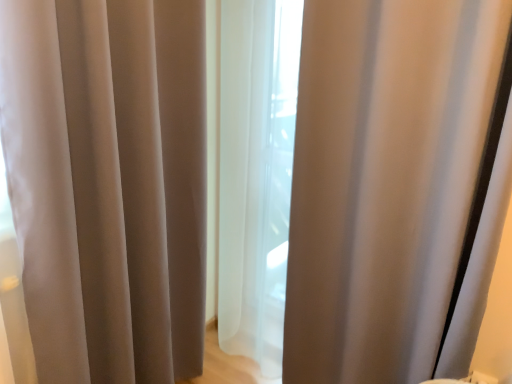
Question: In which direction should I rotate to look at satin beige curtain at center, which is counted as the first curtain, starting from the left?

Choices:
 (A) right
 (B) left

Answer: (B)

Question: Is satin-like beige curtain at center, positioned as the first curtain in right-to-left order, a part of satin beige curtain at center, which is counted as the first curtain, starting from the left?

Choices:
 (A) yes
 (B) no

Answer: (B)

Question: Can you confirm if satin beige curtain at center, which is counted as the first curtain, starting from the left, is thinner than satin-like beige curtain at center, positioned as the first curtain in right-to-left order?

Choices:
 (A) no
 (B) yes

Answer: (B)

Question: From a real-world perspective, is satin beige curtain at center, the 2th curtain positioned from the right, located higher than satin-like beige curtain at center, positioned as the first curtain in right-to-left order?

Choices:
 (A) no
 (B) yes

Answer: (A)

Question: From the image's perspective, is satin beige curtain at center, which is counted as the first curtain, starting from the left, on top of satin-like beige curtain at center, which ranks as the 2th curtain in left-to-right order?

Choices:
 (A) yes
 (B) no

Answer: (B)

Question: Is satin beige curtain at center, the 2th curtain positioned from the right, taller than satin-like beige curtain at center, which ranks as the 2th curtain in left-to-right order?

Choices:
 (A) yes
 (B) no

Answer: (B)

Question: Can you confirm if satin beige curtain at center, the 2th curtain positioned from the right, is positioned to the right of satin-like beige curtain at center, which ranks as the 2th curtain in left-to-right order?

Choices:
 (A) yes
 (B) no

Answer: (B)

Question: Can you confirm if satin-like beige curtain at center, which ranks as the 2th curtain in left-to-right order, is taller than satin beige curtain at center, which is counted as the first curtain, starting from the left?

Choices:
 (A) no
 (B) yes

Answer: (B)

Question: Is satin-like beige curtain at center, which ranks as the 2th curtain in left-to-right order, wider than satin beige curtain at center, the 2th curtain positioned from the right?

Choices:
 (A) no
 (B) yes

Answer: (B)

Question: Can you confirm if satin-like beige curtain at center, positioned as the first curtain in right-to-left order, is shorter than satin beige curtain at center, the 2th curtain positioned from the right?

Choices:
 (A) no
 (B) yes

Answer: (A)

Question: Can you confirm if satin-like beige curtain at center, which ranks as the 2th curtain in left-to-right order, is thinner than satin beige curtain at center, which is counted as the first curtain, starting from the left?

Choices:
 (A) no
 (B) yes

Answer: (A)

Question: From the image's perspective, does satin-like beige curtain at center, positioned as the first curtain in right-to-left order, appear higher than satin beige curtain at center, which is counted as the first curtain, starting from the left?

Choices:
 (A) no
 (B) yes

Answer: (B)

Question: Can you confirm if satin-like beige curtain at center, positioned as the first curtain in right-to-left order, is positioned to the right of satin beige curtain at center, which is counted as the first curtain, starting from the left?

Choices:
 (A) no
 (B) yes

Answer: (B)

Question: Is satin beige curtain at center, which is counted as the first curtain, starting from the left, to the left or to the right of satin-like beige curtain at center, positioned as the first curtain in right-to-left order, in the image?

Choices:
 (A) right
 (B) left

Answer: (B)